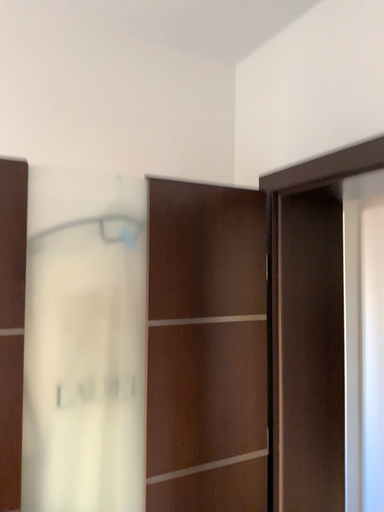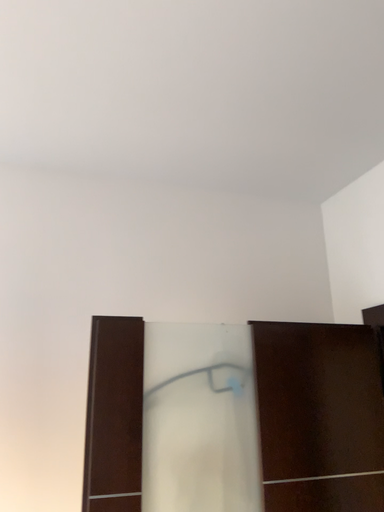
Question: How did the camera likely rotate when shooting the video?

Choices:
 (A) rotated left
 (B) rotated right

Answer: (A)